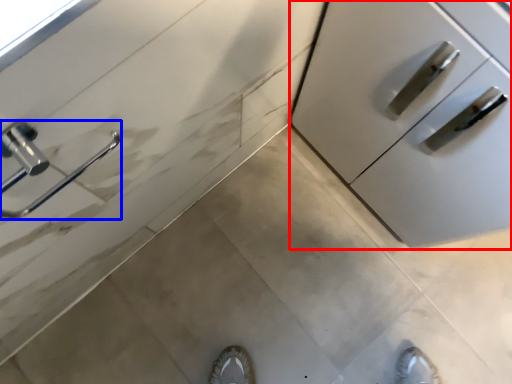
Question: Which of the following is the closest to the observer, cabinetry (highlighted by a red box) or door handle (highlighted by a blue box)?

Choices:
 (A) cabinetry
 (B) door handle

Answer: (B)